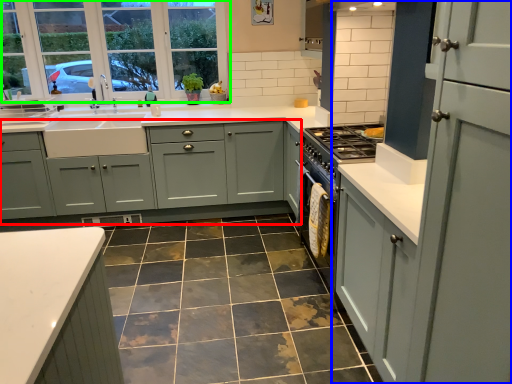
Question: Estimate the real-world distances between objects in this image. Which object is farther from cabinetry (highlighted by a red box), cabinetry (highlighted by a blue box) or window (highlighted by a green box)?

Choices:
 (A) cabinetry
 (B) window

Answer: (A)